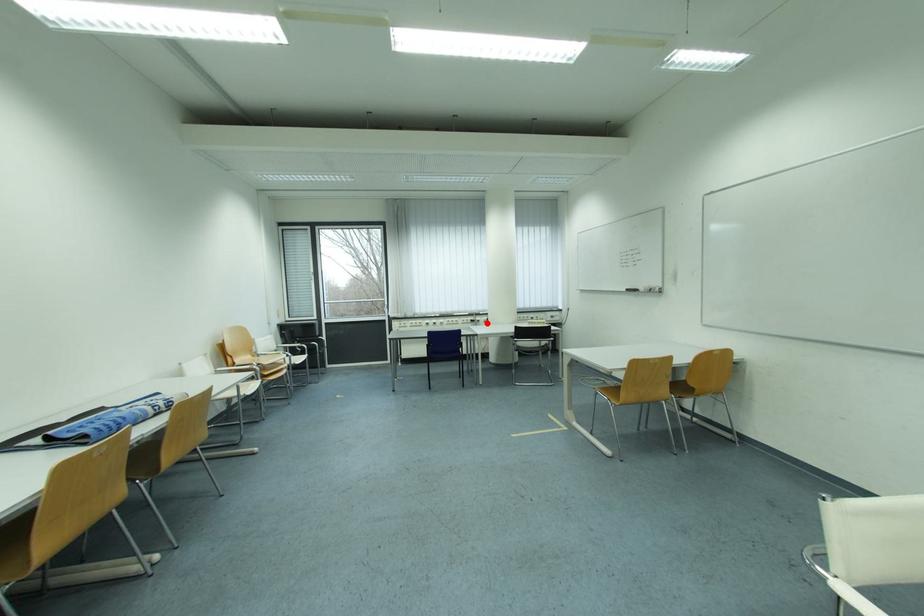
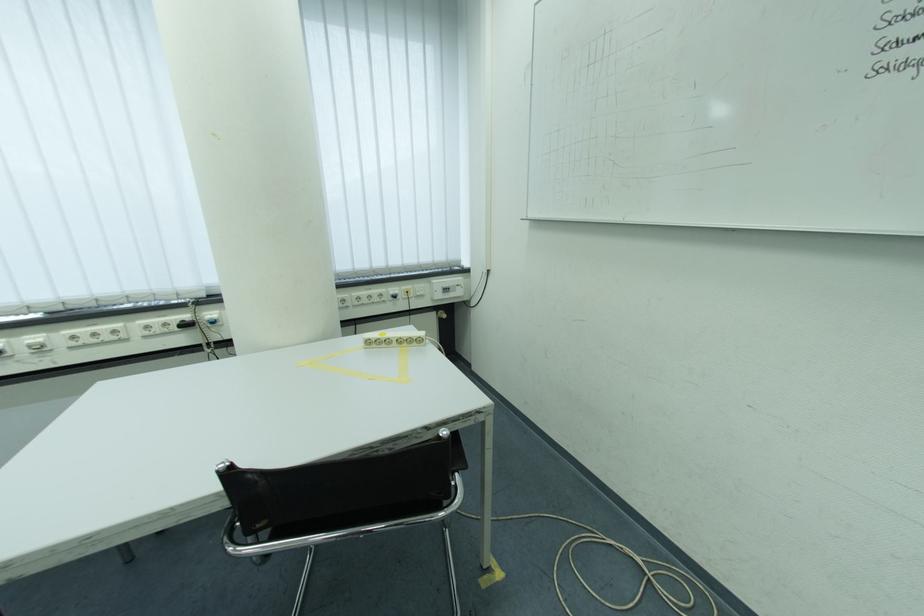
Find the pixel in the second image that matches the highlighted location in the first image.

(223, 325)